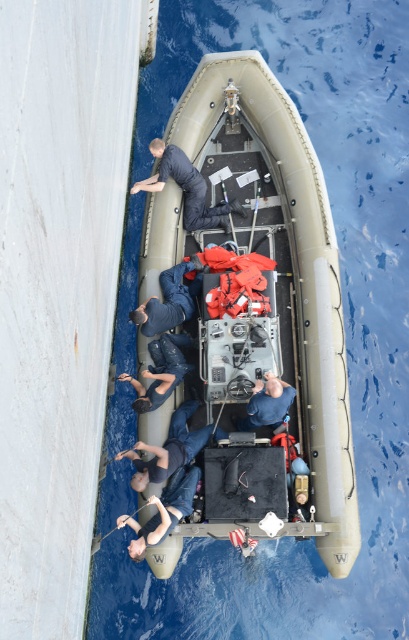
Which is behind, point (222, 429) or point (179, 468)?

The point (222, 429) is more distant.

I want to click on dark blue fabric at center, so click(170, 449).

Between point (354, 545) and point (191, 186), which one is positioned behind?

Point (191, 186)

Is tan rubber boat at center positioned in front of dark blue uniform at center?

Yes, it is.

Is point (327, 536) closer to camera compared to point (218, 205)?

Yes, point (327, 536) is closer to viewer.

Identify the location of tan rubber boat at center. The width and height of the screenshot is (409, 640). (294, 275).

Who is higher up, tan rubber boat at center or dark blue fabric at lower left?

Positioned higher is tan rubber boat at center.

Identify the location of tan rubber boat at center. pos(294,275).

Find the location of `tan rubber boat at center`. tan rubber boat at center is located at coordinates (294, 275).